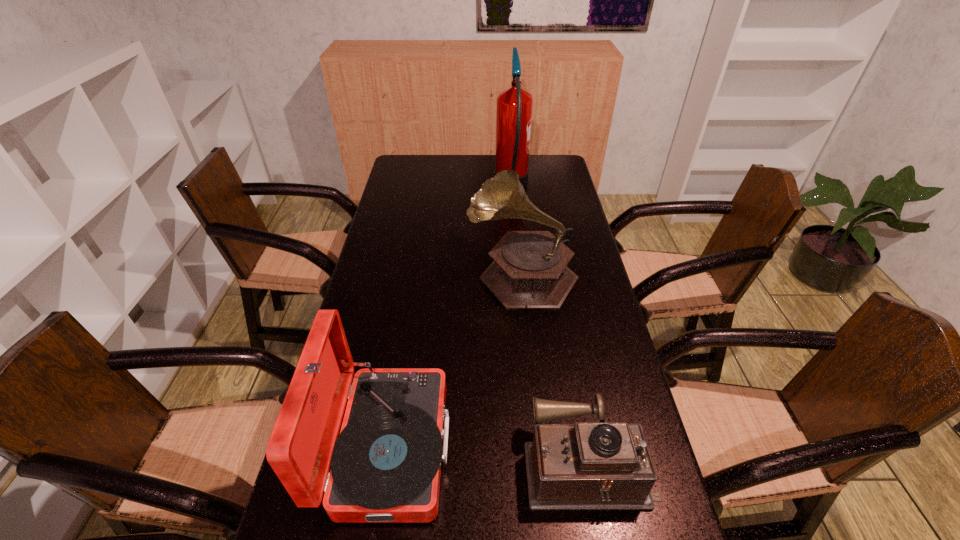
The height and width of the screenshot is (540, 960). Identify the location of free space located on the horn of the shortest phonograph_record. (479, 463).

Find the location of `free space located 0.330m on the horn of the shortest phonograph_record`. free space located 0.330m on the horn of the shortest phonograph_record is located at coordinates (373, 463).

You are a GUI agent. You are given a task and a screenshot of the screen. Output one action in this format:
    pyautogui.click(x=<x>, y=<y>)
    Task: Click on the vacant space located on the horn of the shortest phonograph_record
    The height and width of the screenshot is (540, 960).
    Given the screenshot: What is the action you would take?
    pyautogui.click(x=364, y=463)

Locate an element on the screen. object that is at the far edge is located at coordinates (514, 109).

At what (x,y) coordinates should I click in order to perform the action: click on object that is at the left edge. Please return your answer as a coordinate pair (x, y). This screenshot has width=960, height=540. Looking at the image, I should click on (385, 464).

Locate an element on the screen. free location at the left edge of the desktop is located at coordinates (387, 326).

In the image, there is a desktop. Where is `vacant space at the right edge`? The width and height of the screenshot is (960, 540). vacant space at the right edge is located at coordinates (578, 316).

Where is `vacant space at the far left corner of the desktop`? vacant space at the far left corner of the desktop is located at coordinates (394, 179).

Find the location of a particular element. The image size is (960, 540). free location at the far right corner is located at coordinates (568, 178).

What are the coordinates of `free space between the shortest object and the farthest phonograph_record` in the screenshot? It's located at (555, 368).